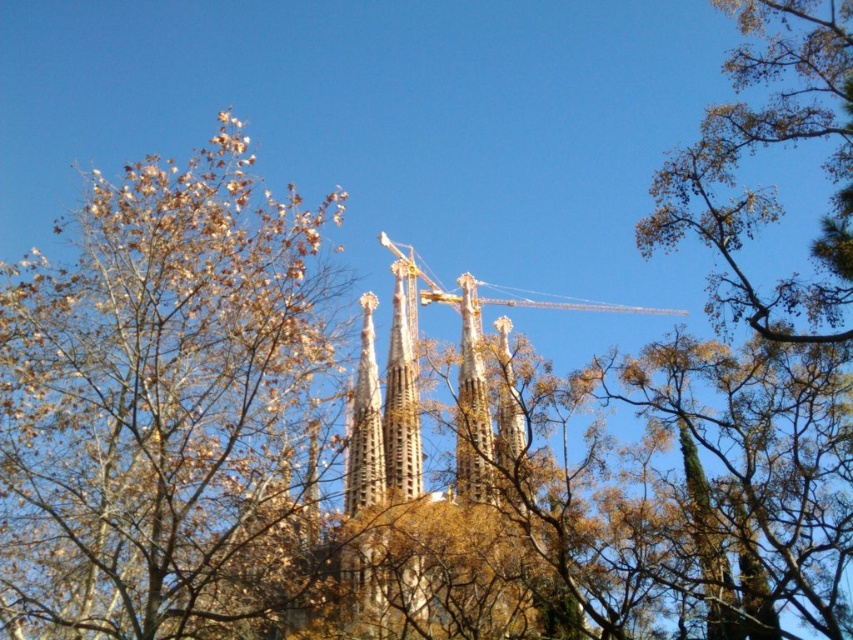
How far apart are brown leafy tree at upper right and golden stone spire at center?

The distance of brown leafy tree at upper right from golden stone spire at center is 34.66 meters.

Can you confirm if brown leafy tree at upper right is positioned below golden stone spire at center?

No.

Is point (793, 76) more distant than point (460, 365)?

No, it is in front of (460, 365).

You are a GUI agent. You are given a task and a screenshot of the screen. Output one action in this format:
    pyautogui.click(x=<x>, y=<y>)
    Task: Click on the brown leafy tree at upper right
    The height and width of the screenshot is (640, 853).
    Given the screenshot: What is the action you would take?
    pyautogui.click(x=763, y=188)

Which is more to the left, brown leafy tree at upper left or brown leafy tree at upper right?

Positioned to the left is brown leafy tree at upper left.

This screenshot has width=853, height=640. Find the location of `brown leafy tree at upper left`. brown leafy tree at upper left is located at coordinates pyautogui.click(x=167, y=406).

Describe the element at coordinates (167, 406) in the screenshot. I see `brown leafy tree at upper left` at that location.

Locate an element on the screen. This screenshot has width=853, height=640. brown leafy tree at upper left is located at coordinates (167, 406).

Is brown leafy tree at upper left below golden stone spire at center?

Incorrect, brown leafy tree at upper left is not positioned below golden stone spire at center.

From the picture: Who is lower down, brown leafy tree at upper left or golden stone spire at center?

golden stone spire at center is lower down.

Image resolution: width=853 pixels, height=640 pixels. Describe the element at coordinates (167, 406) in the screenshot. I see `brown leafy tree at upper left` at that location.

This screenshot has height=640, width=853. In order to click on brown leafy tree at upper left in this screenshot , I will do `click(167, 406)`.